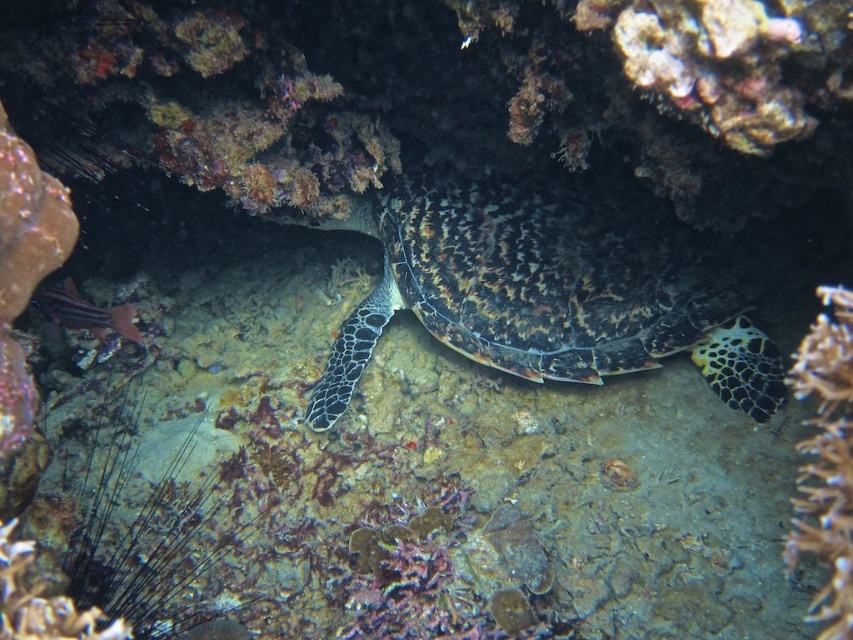
Consider the image. Does leopard-patterned shell at center appear on the right side of translucent white coral at lower right?

In fact, leopard-patterned shell at center is to the left of translucent white coral at lower right.

Which is in front, point (408, 301) or point (839, 404)?

Positioned in front is point (839, 404).

Find the location of a particular element. leopard-patterned shell at center is located at coordinates (548, 288).

Is leopard-patterned shell at center bigger than shiny red fish at lower left?

Yes, leopard-patterned shell at center is bigger than shiny red fish at lower left.

Does leopard-patterned shell at center appear on the left side of shiny red fish at lower left?

In fact, leopard-patterned shell at center is to the right of shiny red fish at lower left.

Does point (647, 296) lie in front of point (51, 312)?

No, (647, 296) is behind (51, 312).

Image resolution: width=853 pixels, height=640 pixels. Identify the location of leopard-patterned shell at center. (548, 288).

Does translucent white coral at lower right appear under shiny red fish at lower left?

Yes.

Is point (833, 380) more distant than point (71, 280)?

No, (833, 380) is in front of (71, 280).

Image resolution: width=853 pixels, height=640 pixels. I want to click on translucent white coral at lower right, so click(x=825, y=460).